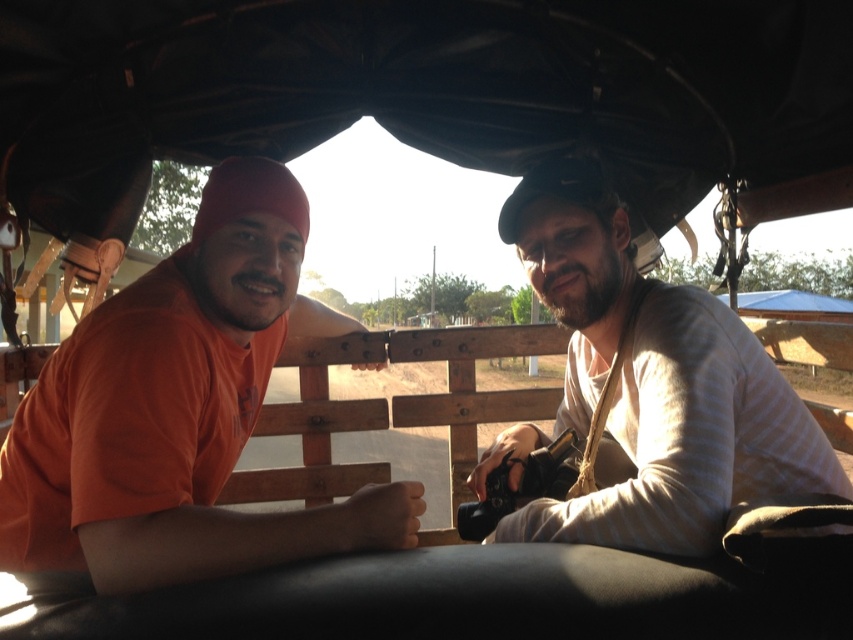
You are taking a photo of the two people in the horse cart. You want to focus on the person closer to the camera. Which point should you focus on, point (247, 358) or point (552, 525)?

Point (247, 358) is further to the camera than point (552, 525), so you should focus on point (247, 358) to capture the person closer to the camera.

You are a photographer trying to capture a balanced composition of the two people in the carriage. Since the orange cotton shirt at left and beige striped shirt at right are part of your focus, which person should you adjust to achieve visual balance?

The orange cotton shirt at left has a lesser height compared to beige striped shirt at right, so to achieve visual balance, you should raise the position of the orange cotton shirt at left or lower the beige striped shirt at right.